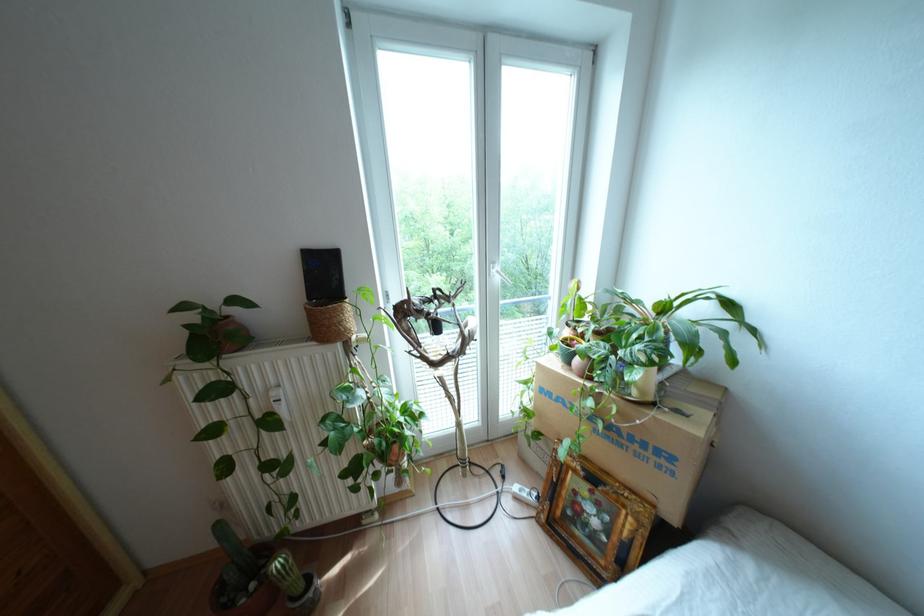
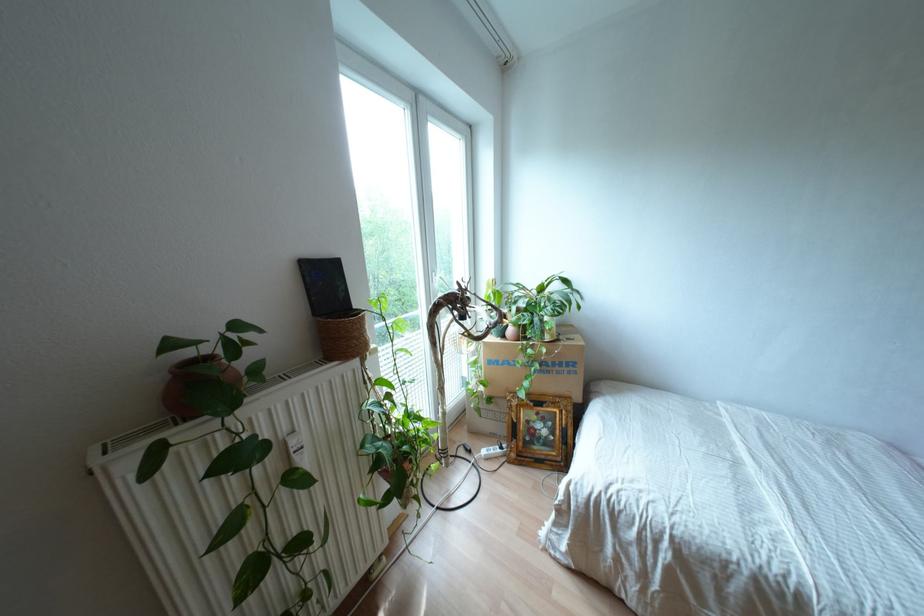
Question: Based on the continuous images, in which direction is the camera rotating? Reply with the corresponding letter.

Choices:
 (A) Left
 (B) Right
 (C) Up
 (D) Down

Answer: (B)